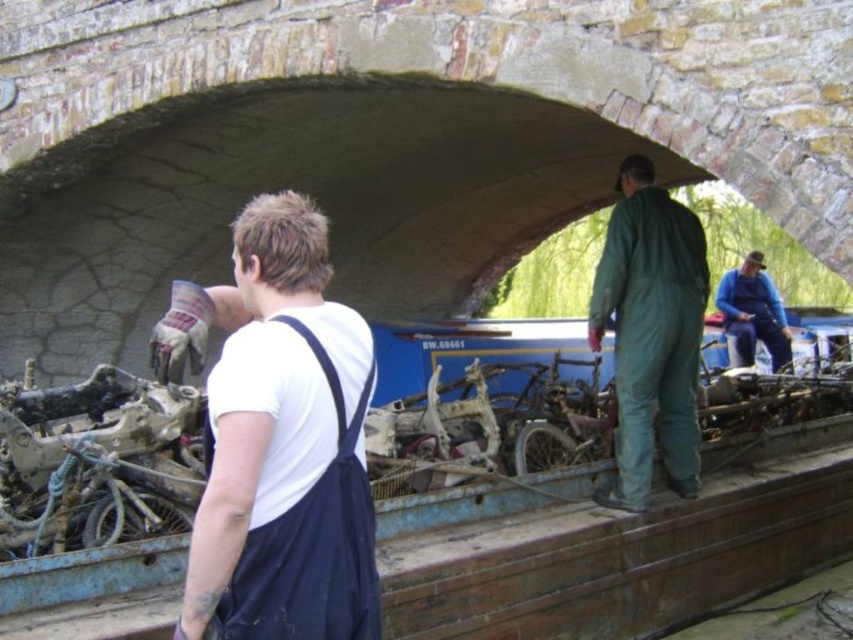
You are standing under the stone archway and see a green matte jumpsuit at center. Where exactly is the green matte jumpsuit located in relation to the point marked at coordinates (651, 332)?

The green matte jumpsuit at center is located at point (651, 332).

You are navigating a small drone through the archway and need to pass between two points marked on the image. The first point is at coordinate point(334, 467) and the second point is at coordinate point(759, 312). Given that the drone must fly in a straight path between these points, will it pass through the dark interior of the archway before reaching the second point?

Yes, the drone will pass through the dark interior of the archway before reaching the second point because point(334, 467) is in front of point(759, 312), meaning the path from the first to the second point goes through the darker area inside the archway.